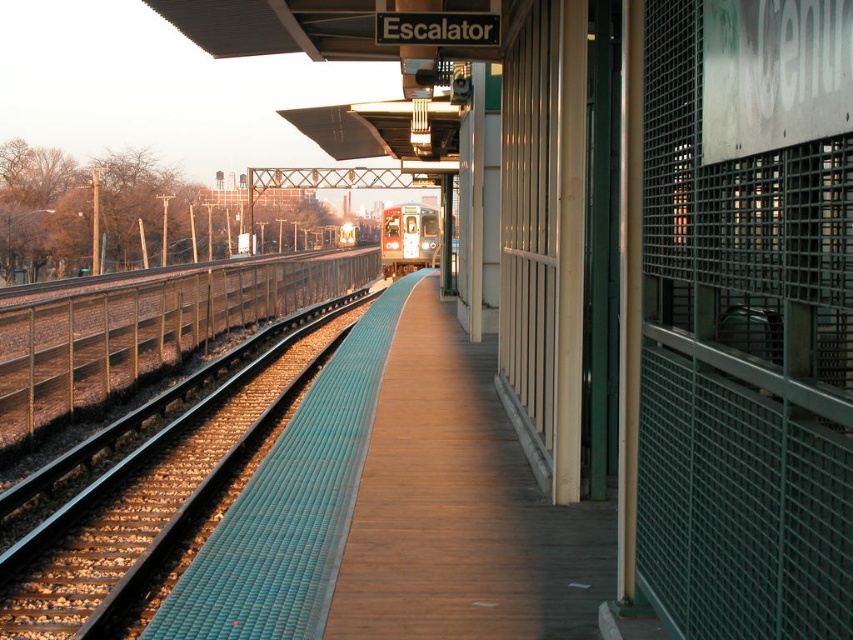
Does teal rubber track at center have a greater height compared to silver metallic train at center?

No.

Does teal rubber track at center have a lesser width compared to silver metallic train at center?

Yes.

Who is more forward, (x=258, y=362) or (x=398, y=221)?

Point (x=258, y=362) is more forward.

Locate an element on the screen. The width and height of the screenshot is (853, 640). teal rubber track at center is located at coordinates (144, 493).

Does teal rubber track at center have a lesser width compared to brown wooden rail at left?

Correct, teal rubber track at center's width is less than brown wooden rail at left's.

Is point (67, 532) closer to camera compared to point (166, 268)?

That is True.

Where is `teal rubber track at center`? teal rubber track at center is located at coordinates (144, 493).

Does brown wooden rail at left have a smaller size compared to silver metallic train at center?

Actually, brown wooden rail at left might be larger than silver metallic train at center.

At what (x,y) coordinates should I click in order to perform the action: click on brown wooden rail at left. Please return your answer as a coordinate pair (x, y). Looking at the image, I should click on (144, 324).